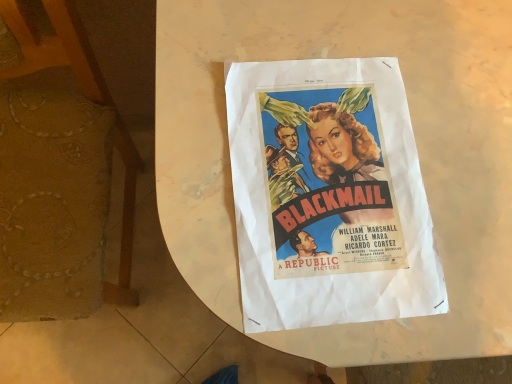
Where is `vacant space behind matte paper poster at center`? This screenshot has width=512, height=384. vacant space behind matte paper poster at center is located at coordinates (390, 48).